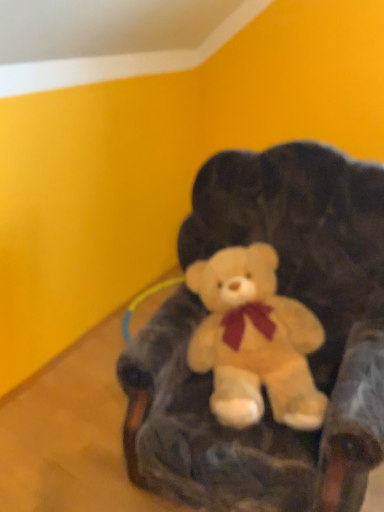
What do you see at coordinates (254, 341) in the screenshot?
I see `soft plush teddy bear at center` at bounding box center [254, 341].

What is the approximate height of soft plush teddy bear at center?

soft plush teddy bear at center is 15.39 inches in height.

Find the location of a particular element. soft plush teddy bear at center is located at coordinates (254, 341).

The width and height of the screenshot is (384, 512). What are the coordinates of `velvety dark brown bean bag chair at center` in the screenshot? It's located at (308, 357).

Describe the element at coordinates (308, 357) in the screenshot. I see `velvety dark brown bean bag chair at center` at that location.

This screenshot has height=512, width=384. In order to click on soft plush teddy bear at center in this screenshot , I will do `click(254, 341)`.

Is velvety dark brown bean bag chair at center to the left of soft plush teddy bear at center from the viewer's perspective?

No, velvety dark brown bean bag chair at center is not to the left of soft plush teddy bear at center.

Relative to soft plush teddy bear at center, is velvety dark brown bean bag chair at center in front or behind?

velvety dark brown bean bag chair at center is positioned closer to the viewer than soft plush teddy bear at center.

Does point (326, 366) come farther from viewer compared to point (233, 285)?

Yes, point (326, 366) is farther from viewer.

Consider the image. From the image's perspective, which one is positioned higher, velvety dark brown bean bag chair at center or soft plush teddy bear at center?

velvety dark brown bean bag chair at center is shown above in the image.

From a real-world perspective, does velvety dark brown bean bag chair at center sit lower than soft plush teddy bear at center?

Incorrect, from a real-world perspective, velvety dark brown bean bag chair at center is higher than soft plush teddy bear at center.

Looking at their sizes, would you say velvety dark brown bean bag chair at center is wider or thinner than soft plush teddy bear at center?

velvety dark brown bean bag chair at center is wider than soft plush teddy bear at center.

Between velvety dark brown bean bag chair at center and soft plush teddy bear at center, which one has more height?

velvety dark brown bean bag chair at center is taller.

In terms of size, does velvety dark brown bean bag chair at center appear bigger or smaller than soft plush teddy bear at center?

Clearly, velvety dark brown bean bag chair at center is larger in size than soft plush teddy bear at center.

Is velvety dark brown bean bag chair at center positioned beyond the bounds of soft plush teddy bear at center?

Yes, velvety dark brown bean bag chair at center is outside of soft plush teddy bear at center.

Is the surface of velvety dark brown bean bag chair at center in direct contact with soft plush teddy bear at center?

No, velvety dark brown bean bag chair at center is not beside soft plush teddy bear at center.

Is velvety dark brown bean bag chair at center positioned with its back to soft plush teddy bear at center?

Correct, velvety dark brown bean bag chair at center is looking away from soft plush teddy bear at center.

How far apart are velvety dark brown bean bag chair at center and soft plush teddy bear at center?

velvety dark brown bean bag chair at center is 5.35 inches from soft plush teddy bear at center.

At what (x,y) coordinates should I click in order to perform the action: click on bean bag chair that appears in front of the soft plush teddy bear at center. Please return your answer as a coordinate pair (x, y). The image size is (384, 512). Looking at the image, I should click on (308, 357).

Considering the positions of objects soft plush teddy bear at center and velvety dark brown bean bag chair at center in the image provided, who is more to the left, soft plush teddy bear at center or velvety dark brown bean bag chair at center?

soft plush teddy bear at center.

Is the depth of soft plush teddy bear at center less than that of velvety dark brown bean bag chair at center?

No, the depth of soft plush teddy bear at center is greater than that of velvety dark brown bean bag chair at center.

Is point (268, 339) positioned after point (361, 441)?

Yes, it is.

From the image's perspective, which is above, soft plush teddy bear at center or velvety dark brown bean bag chair at center?

From the image's view, velvety dark brown bean bag chair at center is above.

From a real-world perspective, which object stands above the other?

In real-world perspective, velvety dark brown bean bag chair at center is above.

Considering the relative sizes of soft plush teddy bear at center and velvety dark brown bean bag chair at center in the image provided, is soft plush teddy bear at center thinner than velvety dark brown bean bag chair at center?

Correct, the width of soft plush teddy bear at center is less than that of velvety dark brown bean bag chair at center.

Based on the photo, does soft plush teddy bear at center have a lesser height compared to velvety dark brown bean bag chair at center?

Correct, soft plush teddy bear at center is not as tall as velvety dark brown bean bag chair at center.

Is soft plush teddy bear at center bigger than velvety dark brown bean bag chair at center?

Incorrect, soft plush teddy bear at center is not larger than velvety dark brown bean bag chair at center.

Do you think soft plush teddy bear at center is within velvety dark brown bean bag chair at center, or outside of it?

soft plush teddy bear at center is located inside velvety dark brown bean bag chair at center.

Does soft plush teddy bear at center touch velvety dark brown bean bag chair at center?

No, soft plush teddy bear at center is not with velvety dark brown bean bag chair at center.

Is soft plush teddy bear at center facing away from velvety dark brown bean bag chair at center?

Yes, soft plush teddy bear at center is positioned with its back facing velvety dark brown bean bag chair at center.

How many degrees apart are the facing directions of soft plush teddy bear at center and velvety dark brown bean bag chair at center?

soft plush teddy bear at center and velvety dark brown bean bag chair at center are facing 25 degrees away from each other.

Where is `teddy bear on the left of velvety dark brown bean bag chair at center`? teddy bear on the left of velvety dark brown bean bag chair at center is located at coordinates (254, 341).

Find the location of `teddy bear behind the velvety dark brown bean bag chair at center`. teddy bear behind the velvety dark brown bean bag chair at center is located at coordinates (254, 341).

Image resolution: width=384 pixels, height=512 pixels. What are the coordinates of `teddy bear that is below the velvety dark brown bean bag chair at center (from the image's perspective)` in the screenshot? It's located at (254, 341).